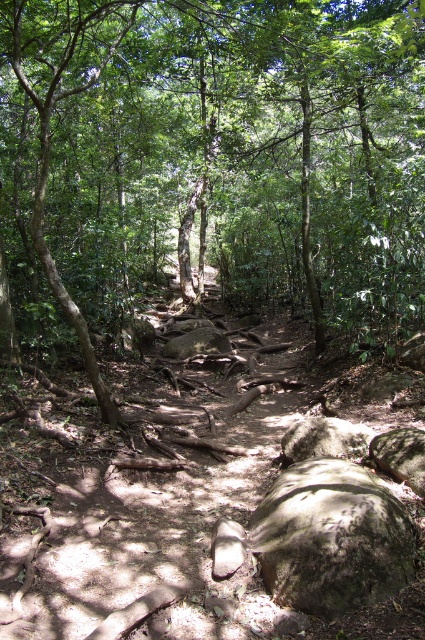
Question: Which point appears farthest from the camera in this image?

Choices:
 (A) (339, 579)
 (B) (170, 356)
 (C) (153, 170)
 (D) (348, 440)

Answer: (C)

Question: Observing the image, what is the correct spatial positioning of gray rough rock at center in reference to rough gray rock at lower right?

Choices:
 (A) above
 (B) below

Answer: (B)

Question: Estimate the real-world distances between objects in this image. Which object is closer to the green leafy tree at center?

Choices:
 (A) dull brown dirt path at center
 (B) gray rough rock at center
 (C) smooth gray rock at center
 (D) green mossy rock at lower center

Answer: (C)

Question: Can you confirm if rough gray rock at lower right is positioned below smooth gray rock at center?

Choices:
 (A) yes
 (B) no

Answer: (A)

Question: Is the position of green leafy tree at center less distant than that of green mossy rock at lower center?

Choices:
 (A) no
 (B) yes

Answer: (A)

Question: Which of these objects is positioned farthest from the smooth gray rock at center?

Choices:
 (A) green leafy tree at center
 (B) dull brown dirt path at center
 (C) gray rough rock at center
 (D) rough gray rock at lower right

Answer: (B)